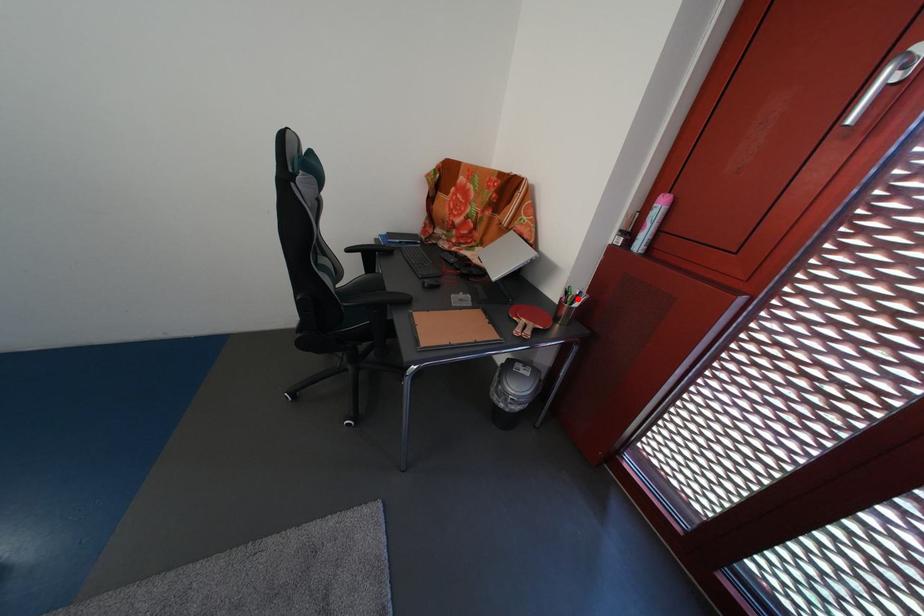
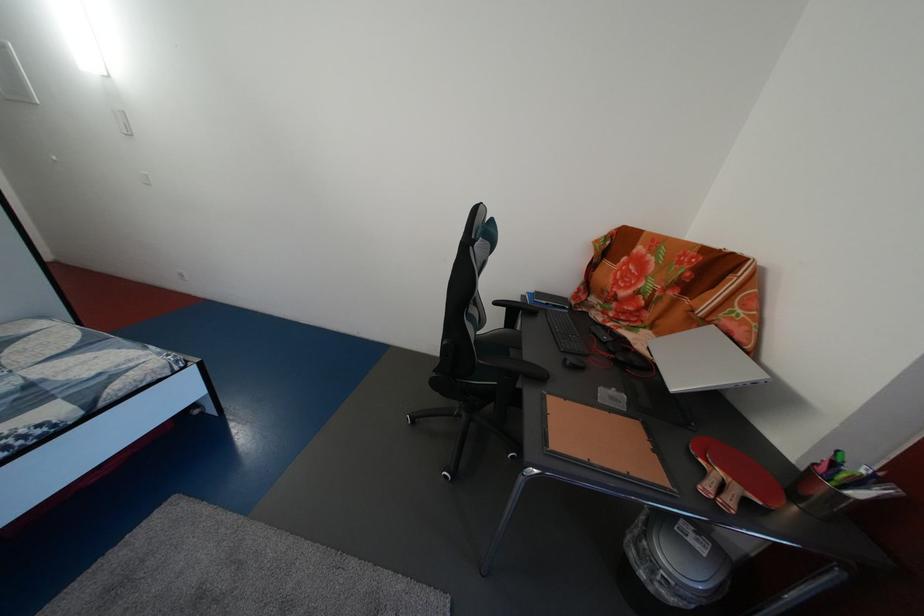
Locate, in the second image, the point that corresponds to the highlighted location in the first image.

(845, 471)